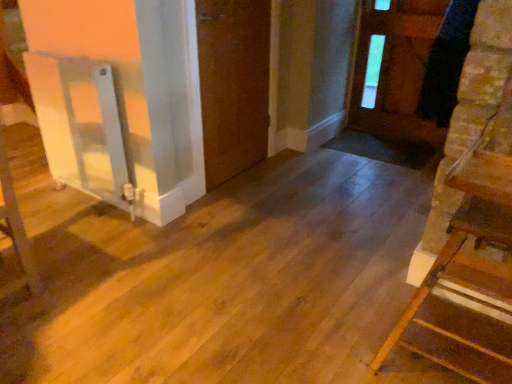
Locate an element on the screen. This screenshot has height=384, width=512. vacant area situated to the left side of wooden staircase at right is located at coordinates (326, 325).